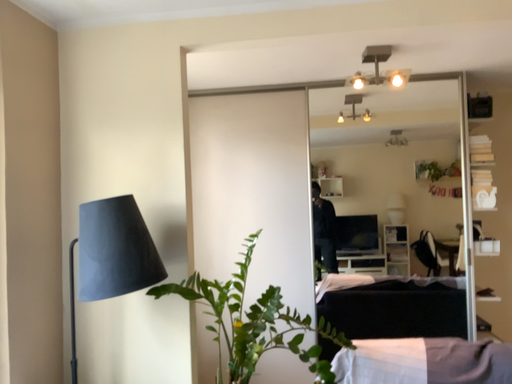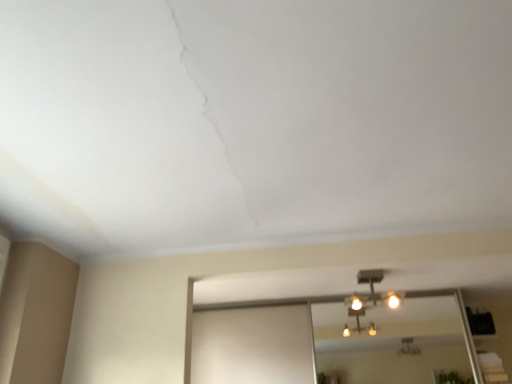
Question: How did the camera likely rotate when shooting the video?

Choices:
 (A) rotated downward
 (B) rotated upward

Answer: (B)